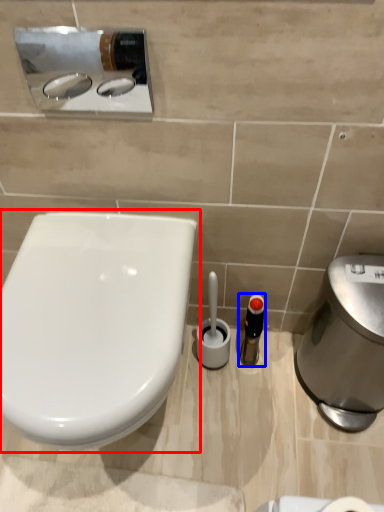
Question: Among these objects, which one is nearest to the camera, toilet (highlighted by a red box) or toiletry (highlighted by a blue box)?

Choices:
 (A) toilet
 (B) toiletry

Answer: (A)